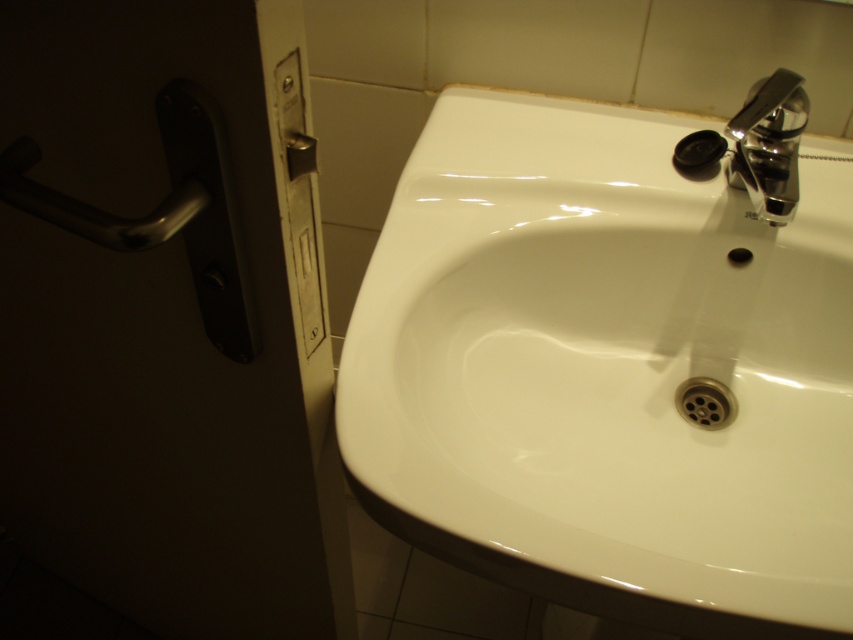
Based on the photo, you are standing in front of the bathroom sink area. There is a point marked at coordinates (x=607, y=371). What object is located at that point?

The white glossy sink at center is located at point (x=607, y=371).

You are trying to determine if the white glossy sink at center can fit through the doorway near the polished metal door handle at left. Based on their sizes, is this possible?

The white glossy sink at center might be wider than the polished metal door handle at left, so it may not fit through the doorway unless the door is wide enough to accommodate its width.

In the scene shown: Based on the scene description, where is the white glossy sink at center located in terms of its 2D coordinates?

The white glossy sink at center is located at the 2D coordinates of point (607, 371).